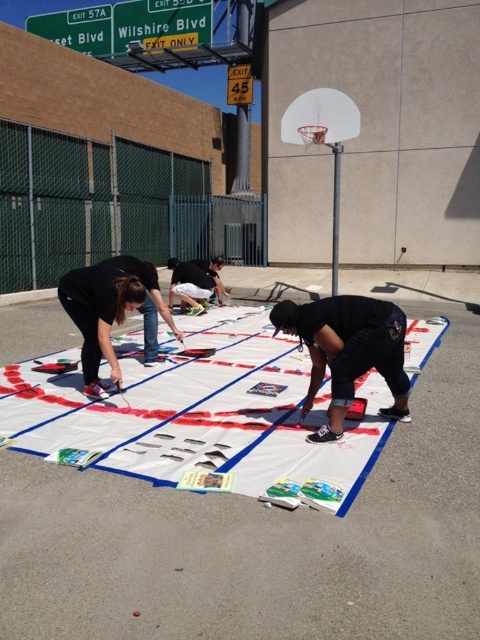
Question: Which object is positioned closest to the black matte pants at center?

Choices:
 (A) black fabric at center
 (B) white plastic basketball hoop at upper right
 (C) greensignboard at upper center
 (D) black fabric shirt at center

Answer: (A)

Question: Which object is farther from the camera taking this photo?

Choices:
 (A) white paper quilt at center
 (B) black matte pants at center
 (C) greensignboard at upper center

Answer: (C)

Question: From the image, what is the correct spatial relationship of green metallic street sign at upper left in relation to black fabric shirt at center?

Choices:
 (A) above
 (B) below

Answer: (A)

Question: Which of the following is the farthest from the observer?

Choices:
 (A) click(x=80, y=45)
 (B) click(x=192, y=285)

Answer: (A)

Question: Is black matte pants at center in front of green metallic street sign at upper left?

Choices:
 (A) no
 (B) yes

Answer: (B)

Question: Is green metallic street sign at upper left below black fabric shirt at center?

Choices:
 (A) no
 (B) yes

Answer: (A)